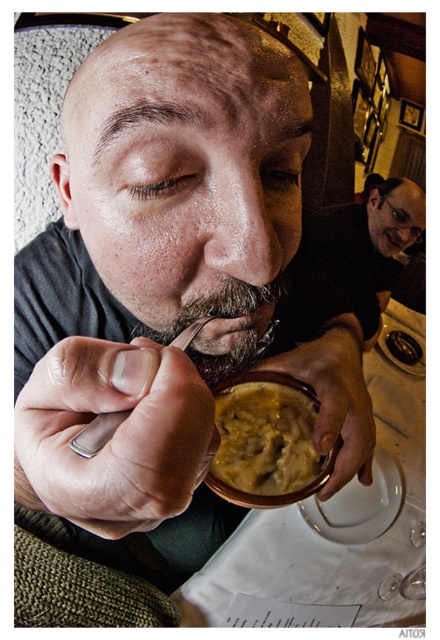
Consider the image. You are a waiter in a restaurant holding a tray of dishes. You need to place a new spoon next to the existing silver metallic spoon at lower center without disturbing the matte black shirt at upper right. Considering the distance between them, can you safely place the new spoon 1.5 meters away from the existing spoon?

The distance between the matte black shirt at upper right and the silver metallic spoon at lower center is 1.35 meters. Placing the new spoon 1.5 meters away from the existing spoon would exceed this distance, potentially disturbing the matte black shirt at upper right. Therefore, it is not safe to place the new spoon 1.5 meters away from the existing spoon.

You are a waiter in a restaurant and need to place a new menu on the table between the yellow creamy food at center and the silver metallic spoon at lower center. Based on their positions, where should you place the menu so it doesn

The yellow creamy food at center is closer to you than the silver metallic spoon at lower center. Therefore, you should place the menu between them by positioning it closer to the spoon since the food is already in front of the spoon.